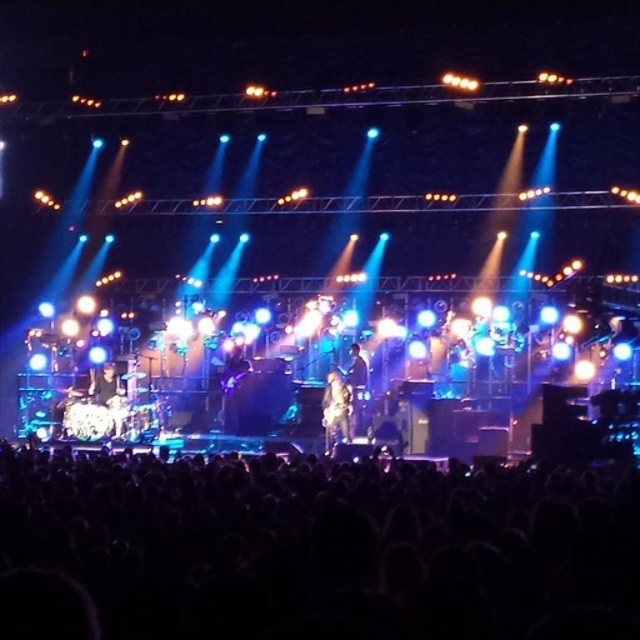
Question: Which is nearer to the black matte crowd at lower center?

Choices:
 (A) metallic guitar at center
 (B) camouflage-patterned shirt at center

Answer: (B)

Question: Which point is closer to the camera taking this photo?

Choices:
 (A) (326, 442)
 (B) (109, 371)

Answer: (A)

Question: Can you confirm if black matte crowd at lower center is wider than shiny black drum set at left?

Choices:
 (A) no
 (B) yes

Answer: (B)

Question: Does black matte crowd at lower center appear over shiny black drum set at left?

Choices:
 (A) no
 (B) yes

Answer: (A)

Question: Estimate the real-world distances between objects in this image. Which object is closer to the shiny black drum set at left?

Choices:
 (A) black matte crowd at lower center
 (B) metallic guitar at center
 (C) camouflage-patterned shirt at center

Answer: (B)

Question: Is camouflage-patterned shirt at center below shiny black drum set at left?

Choices:
 (A) no
 (B) yes

Answer: (B)